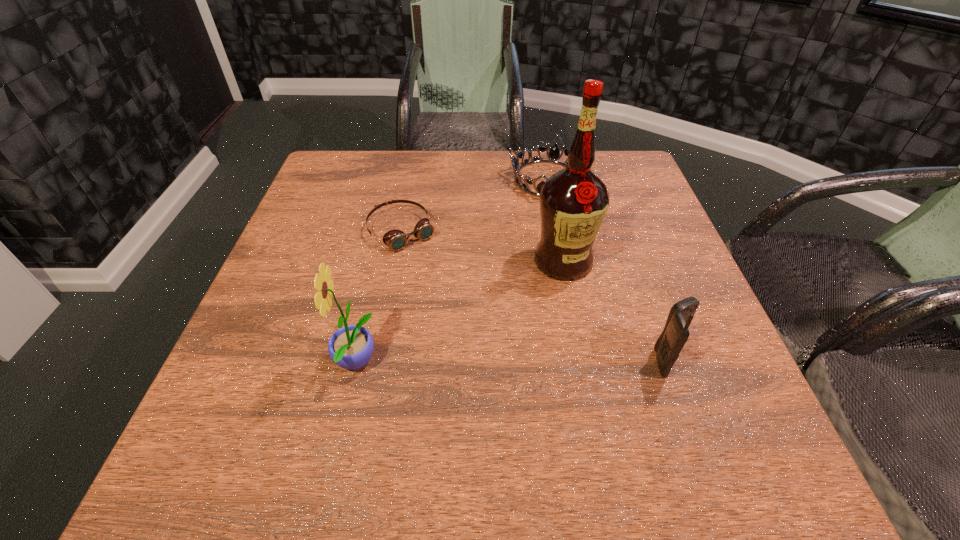
Identify the location of vacant space on the desktop that is between the sunflower and the third tallest object and is positioned on the front-facing side of the tiara. (488, 362).

The height and width of the screenshot is (540, 960). Identify the location of free spot on the desktop that is between the sunflower and the rightmost object and is positioned through the lenses of the goggles. (508, 362).

Find the location of `free space on the desktop that is between the fourth shortest object and the cellular telephone and is positioned on the label of the tallest object`. free space on the desktop that is between the fourth shortest object and the cellular telephone and is positioned on the label of the tallest object is located at coordinates (515, 362).